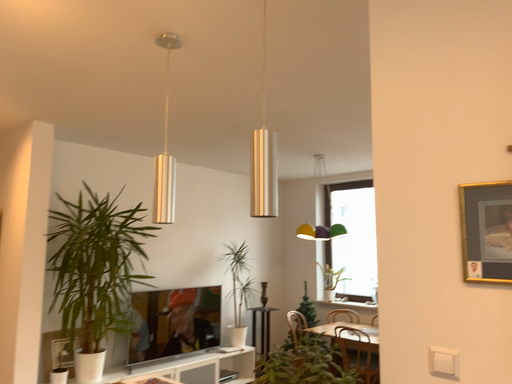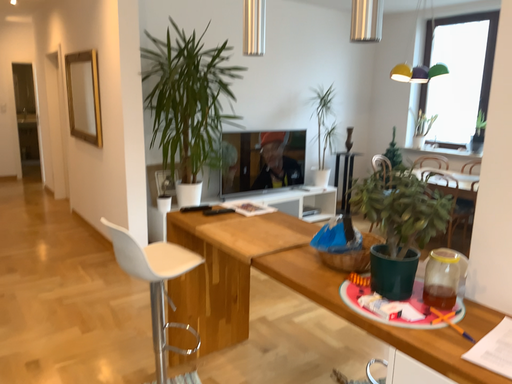
Question: How did the camera likely rotate when shooting the video?

Choices:
 (A) rotated right
 (B) rotated left

Answer: (B)